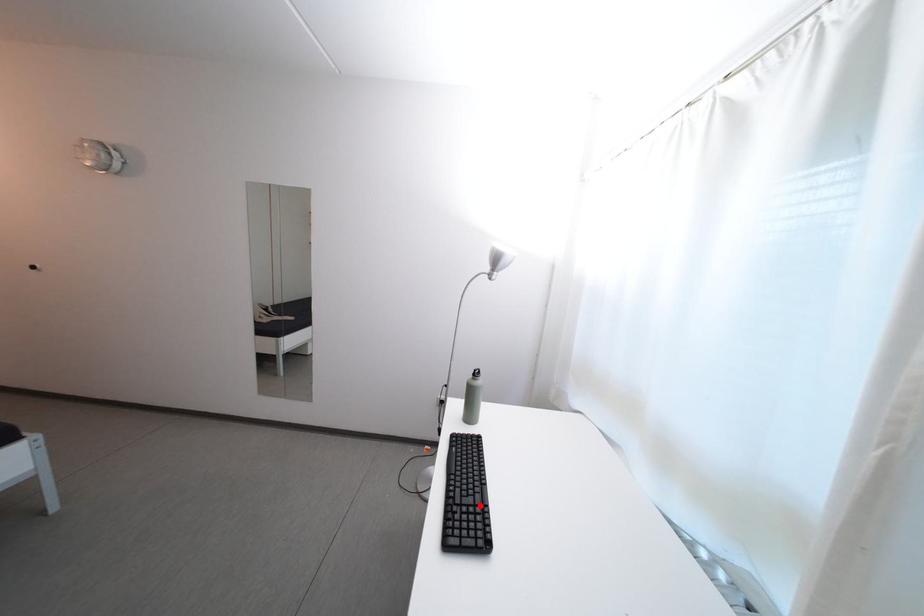
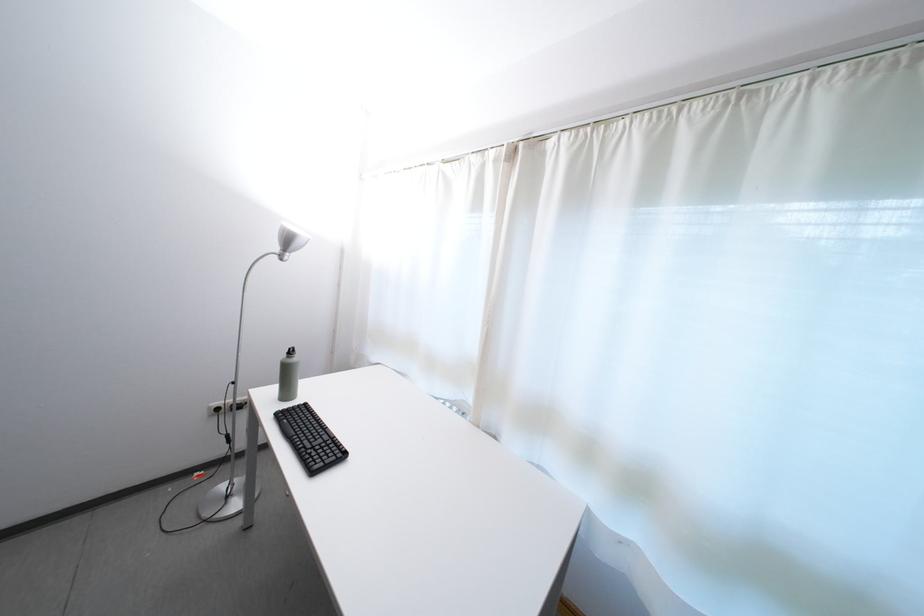
In the second image, find the point that corresponds to the highlighted location in the first image.

(330, 447)